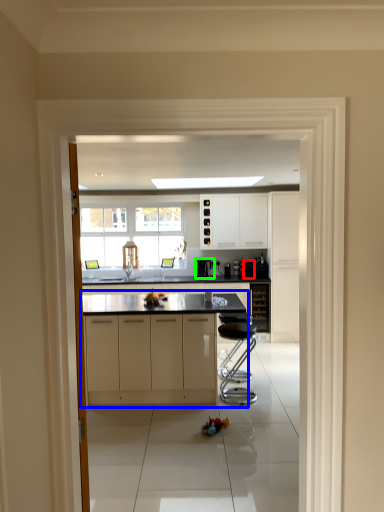
Question: Which object is the closest to the appliance (highlighted by a red box)? Choose among these: cabinetry (highlighted by a blue box) or appliance (highlighted by a green box).

Choices:
 (A) cabinetry
 (B) appliance

Answer: (B)